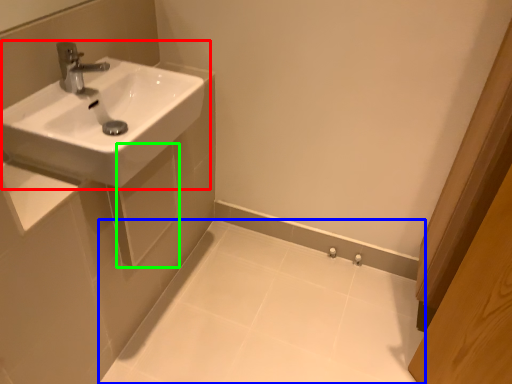
Question: Based on their relative distances, which object is farther from sink (highlighted by a red box)? Choose from porcelain (highlighted by a blue box) and square (highlighted by a green box).

Choices:
 (A) porcelain
 (B) square

Answer: (A)